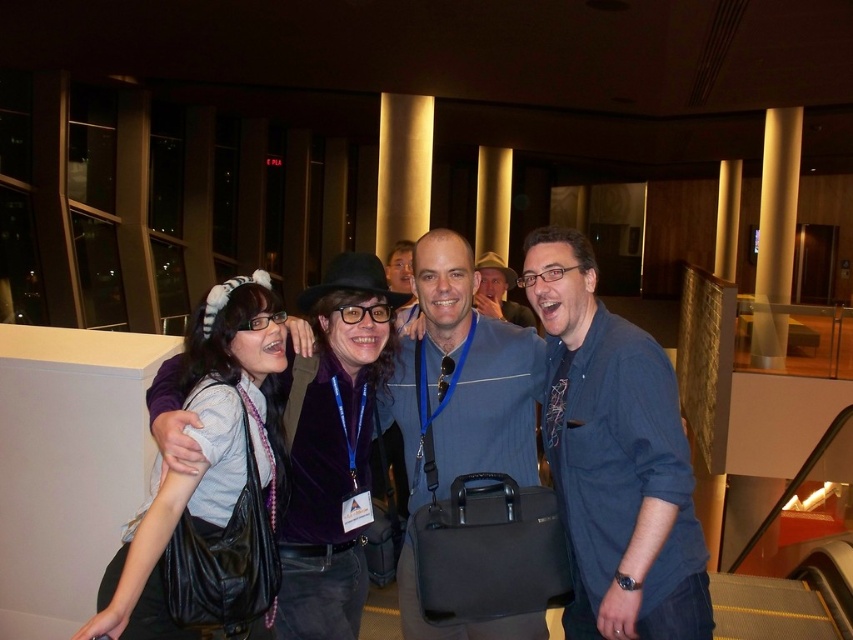
Question: Does blue cotton shirt at right have a lesser width compared to black leather bag at center?

Choices:
 (A) no
 (B) yes

Answer: (A)

Question: Which object is closer to the camera taking this photo?

Choices:
 (A) matte black purse at center
 (B) black leather bag at center
 (C) blue cotton shirt at right
 (D) blue fabric shirt at center

Answer: (B)

Question: Which point appears farthest from the camera in this image?

Choices:
 (A) (698, 531)
 (B) (425, 497)

Answer: (B)

Question: Does matte black purse at center appear on the left side of matte blue shirt at center?

Choices:
 (A) yes
 (B) no

Answer: (A)

Question: Estimate the real-world distances between objects in this image. Which object is farther from the black leather bag at center?

Choices:
 (A) blue cotton shirt at right
 (B) matte black purse at center
 (C) blue fabric shirt at center
 (D) matte blue shirt at center

Answer: (D)

Question: Is matte black purse at center below matte blue shirt at center?

Choices:
 (A) yes
 (B) no

Answer: (A)